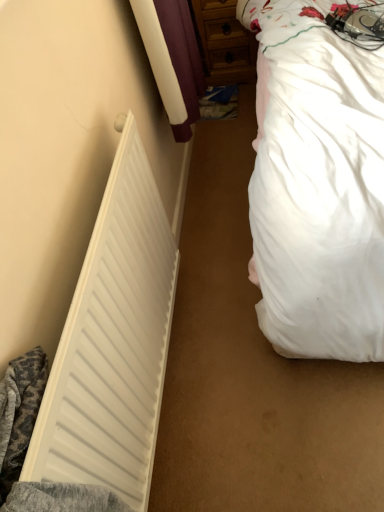
Question: Choose the correct answer: Is white matte radiator at left inside wooden dresser at upper center or outside it?

Choices:
 (A) inside
 (B) outside

Answer: (B)

Question: Considering the positions of white matte radiator at left and wooden dresser at upper center in the image, is white matte radiator at left bigger or smaller than wooden dresser at upper center?

Choices:
 (A) big
 (B) small

Answer: (B)

Question: Based on their relative distances, which object is farther from the white matte radiator at left?

Choices:
 (A) wooden dresser at upper center
 (B) white soft bed at right

Answer: (A)

Question: Which object is positioned closest to the wooden dresser at upper center?

Choices:
 (A) white matte radiator at left
 (B) white soft bed at right

Answer: (B)